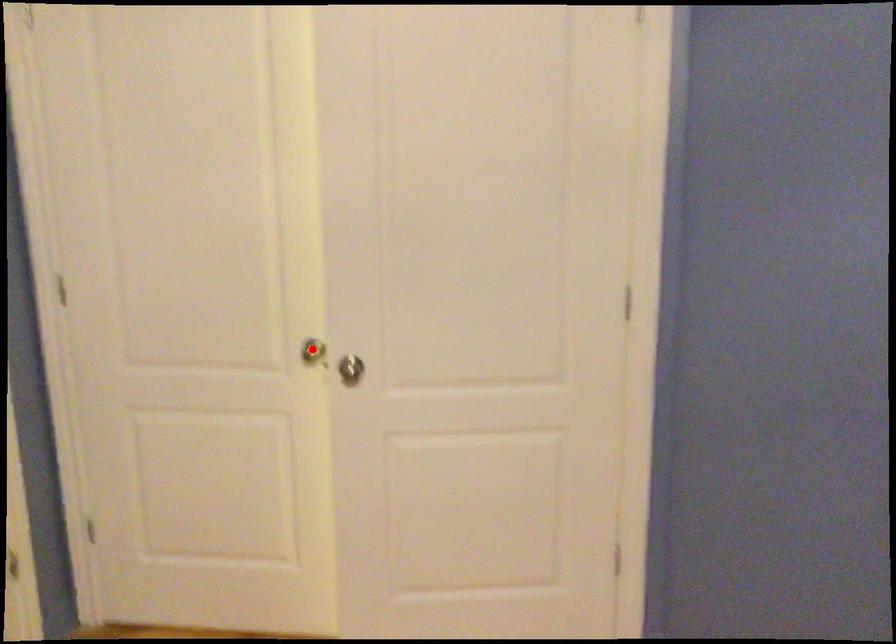
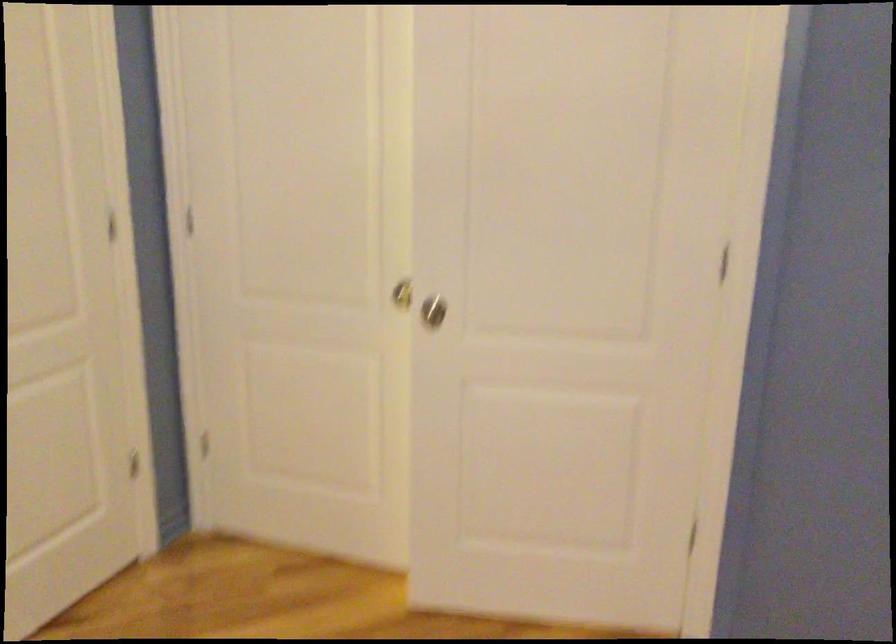
Find the pixel in the second image that matches the highlighted location in the first image.

(401, 292)